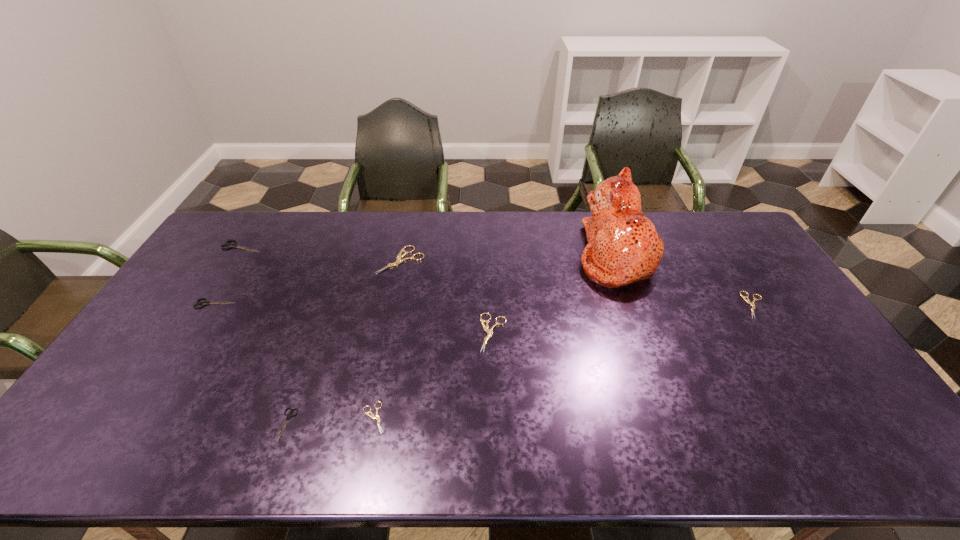
Locate an element on the screen. The height and width of the screenshot is (540, 960). the seventh object from left to right is located at coordinates (624, 247).

Locate an element on the screen. The width and height of the screenshot is (960, 540). the tallest object is located at coordinates (624, 247).

At what (x,y) coordinates should I click in order to perform the action: click on the biggest black shears. Please return your answer as a coordinate pair (x, y). Looking at the image, I should click on (231, 245).

At what (x,y) coordinates should I click in order to perform the action: click on the farthest beige shears. Please return your answer as a coordinate pair (x, y). This screenshot has width=960, height=540. Looking at the image, I should click on (399, 260).

This screenshot has width=960, height=540. What are the coordinates of `the second biggest black shears` in the screenshot? It's located at (205, 302).

This screenshot has width=960, height=540. I want to click on the second beige shears from right to left, so click(x=489, y=331).

This screenshot has height=540, width=960. I want to click on the third object from right to left, so click(x=489, y=331).

What are the coordinates of `the second smallest beige shears` in the screenshot? It's located at (747, 300).

Where is `the rightmost beige shears`? The height and width of the screenshot is (540, 960). the rightmost beige shears is located at coordinates (747, 300).

The width and height of the screenshot is (960, 540). I want to click on the third shears from left to right, so click(x=288, y=416).